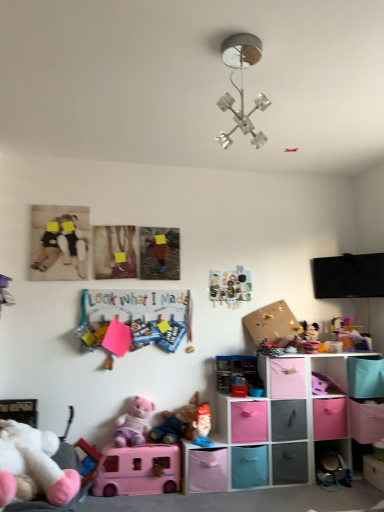
Question: Does pink fabric storage bin at lower center, the 3th shelf when ordered from left to right, have a greater height compared to plush fabric toy at lower center, positioned as the sixth toy in left-to-right order?

Choices:
 (A) yes
 (B) no

Answer: (B)

Question: Is pink fabric storage bin at lower center, arranged as the 5th shelf when viewed from the right, positioned far away from plush fabric toy at lower center, the 6th toy when ordered from right to left?

Choices:
 (A) yes
 (B) no

Answer: (B)

Question: Is pink fabric storage bin at lower center, the 3th shelf when ordered from left to right, outside of plush fabric toy at lower center, positioned as the sixth toy in left-to-right order?

Choices:
 (A) yes
 (B) no

Answer: (A)

Question: Is pink fabric storage bin at lower center, the 3th shelf when ordered from left to right, to the left of plush fabric toy at lower center, the 6th toy when ordered from right to left, from the viewer's perspective?

Choices:
 (A) no
 (B) yes

Answer: (A)

Question: From a real-world perspective, is pink fabric storage bin at lower center, the 3th shelf when ordered from left to right, physically above plush fabric toy at lower center, the 6th toy when ordered from right to left?

Choices:
 (A) no
 (B) yes

Answer: (A)

Question: Considering the positions of pink plush toy at lower center, marked as the 4th toy in a left-to-right arrangement, and translucent plastic toy at right, placed as the first toy when sorted from right to left, in the image, is pink plush toy at lower center, marked as the 4th toy in a left-to-right arrangement, bigger or smaller than translucent plastic toy at right, placed as the first toy when sorted from right to left,?

Choices:
 (A) small
 (B) big

Answer: (B)

Question: Considering the positions of pink plush toy at lower center, marked as the 4th toy in a left-to-right arrangement, and translucent plastic toy at right, placed as the first toy when sorted from right to left, in the image, is pink plush toy at lower center, marked as the 4th toy in a left-to-right arrangement, wider or thinner than translucent plastic toy at right, placed as the first toy when sorted from right to left,?

Choices:
 (A) thin
 (B) wide

Answer: (B)

Question: Considering their positions, is pink plush toy at lower center, marked as the 4th toy in a left-to-right arrangement, located in front of or behind translucent plastic toy at right, which is the 11th toy from left to right?

Choices:
 (A) behind
 (B) front

Answer: (B)

Question: Based on their positions, is pink plush toy at lower center, which appears as the 8th toy when viewed from the right, located to the left or right of translucent plastic toy at right, which is the 11th toy from left to right?

Choices:
 (A) left
 (B) right

Answer: (A)

Question: From the image's perspective, is transparent plastic shelf at lower right, the 6th shelf positioned from the left, above or below matte plastic toy at center, the seventh toy in the left-to-right sequence?

Choices:
 (A) above
 (B) below

Answer: (A)

Question: In terms of height, does transparent plastic shelf at lower right, which is the second shelf in right-to-left order, look taller or shorter compared to matte plastic toy at center, placed as the 5th toy when sorted from right to left?

Choices:
 (A) short
 (B) tall

Answer: (B)

Question: Is transparent plastic shelf at lower right, which is the second shelf in right-to-left order, inside the boundaries of matte plastic toy at center, the seventh toy in the left-to-right sequence, or outside?

Choices:
 (A) outside
 (B) inside

Answer: (A)

Question: In terms of width, does transparent plastic shelf at lower right, the 6th shelf positioned from the left, look wider or thinner when compared to matte plastic toy at center, placed as the 5th toy when sorted from right to left?

Choices:
 (A) wide
 (B) thin

Answer: (A)

Question: In the image, is white plush toy at lower left, the second toy positioned from the left, positioned in front of or behind matte black storage cube at lower center, which appears as the 5th shelf when viewed from the left?

Choices:
 (A) front
 (B) behind

Answer: (A)

Question: From the image's perspective, is white plush toy at lower left, the 10th toy viewed from the right, positioned above or below matte black storage cube at lower center, arranged as the 3th shelf when viewed from the right?

Choices:
 (A) above
 (B) below

Answer: (A)